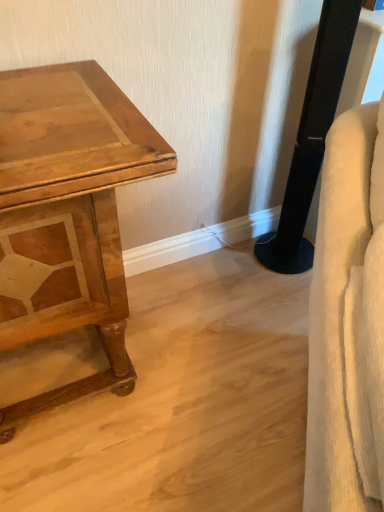
Question: Are wooden table at left and white fabric swivel chair at right far apart?

Choices:
 (A) yes
 (B) no

Answer: (B)

Question: Does wooden table at left have a larger size compared to white fabric swivel chair at right?

Choices:
 (A) yes
 (B) no

Answer: (A)

Question: Could white fabric swivel chair at right be considered to be inside wooden table at left?

Choices:
 (A) yes
 (B) no

Answer: (B)

Question: Is wooden table at left looking in the opposite direction of white fabric swivel chair at right?

Choices:
 (A) yes
 (B) no

Answer: (B)

Question: From a real-world perspective, does wooden table at left sit lower than white fabric swivel chair at right?

Choices:
 (A) no
 (B) yes

Answer: (B)

Question: Considering the relative positions of wooden table at left and white fabric swivel chair at right in the image provided, is wooden table at left to the left of white fabric swivel chair at right from the viewer's perspective?

Choices:
 (A) no
 (B) yes

Answer: (B)

Question: Does white fabric swivel chair at right have a lesser width compared to black plastic speaker at right?

Choices:
 (A) yes
 (B) no

Answer: (A)

Question: Could you tell me if white fabric swivel chair at right is turned towards black plastic speaker at right?

Choices:
 (A) no
 (B) yes

Answer: (A)

Question: Is black plastic speaker at right inside white fabric swivel chair at right?

Choices:
 (A) yes
 (B) no

Answer: (B)

Question: Is black plastic speaker at right at the back of white fabric swivel chair at right?

Choices:
 (A) yes
 (B) no

Answer: (B)

Question: Is white fabric swivel chair at right outside of black plastic speaker at right?

Choices:
 (A) yes
 (B) no

Answer: (A)

Question: Considering the relative sizes of white fabric swivel chair at right and black plastic speaker at right in the image provided, is white fabric swivel chair at right taller than black plastic speaker at right?

Choices:
 (A) no
 (B) yes

Answer: (A)

Question: Considering the relative sizes of black plastic speaker at right and wooden table at left in the image provided, is black plastic speaker at right smaller than wooden table at left?

Choices:
 (A) no
 (B) yes

Answer: (B)